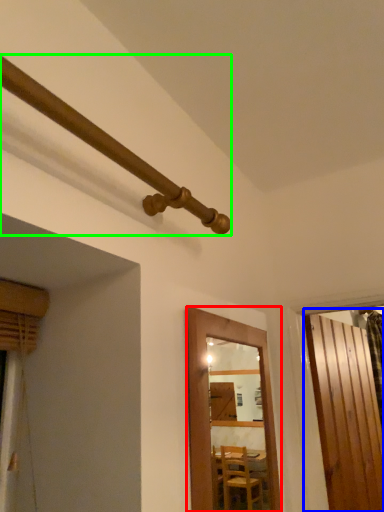
Question: Estimate the real-world distances between objects in this image. Which object is farther from door (highlighted by a red box), door (highlighted by a blue box) or pipe (highlighted by a green box)?

Choices:
 (A) door
 (B) pipe

Answer: (A)